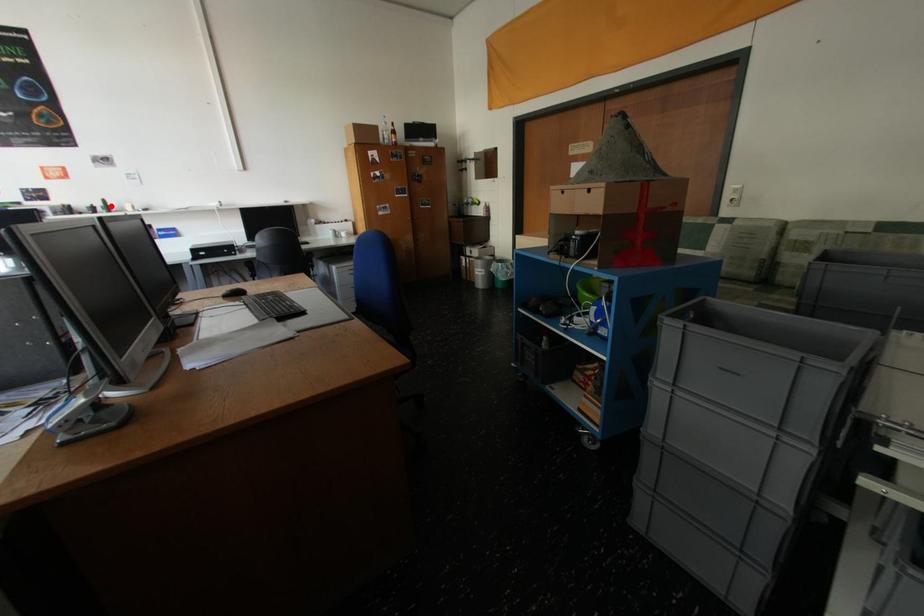
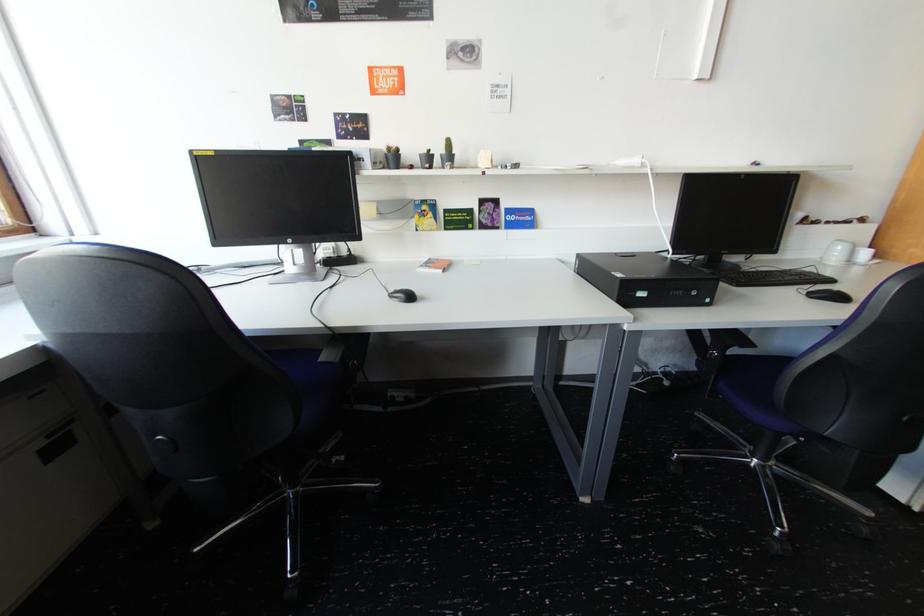
Question: I am providing you with two images of the same scene from different viewpoints. In image1, a red point is highlighted. Considering the same 3D point in image2, which of the following is correct?

Choices:
 (A) It is closer
 (B) It is farther

Answer: (A)